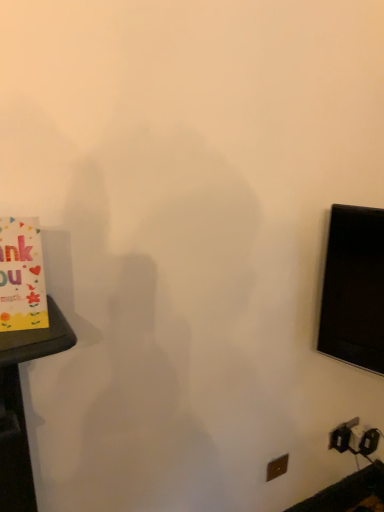
Question: From a real-world perspective, is brown plastic electric outlet at lower right positioned over yellow paper card at left based on gravity?

Choices:
 (A) yes
 (B) no

Answer: (B)

Question: Is brown plastic electric outlet at lower right looking in the opposite direction of yellow paper card at left?

Choices:
 (A) yes
 (B) no

Answer: (B)

Question: Does brown plastic electric outlet at lower right have a greater width compared to yellow paper card at left?

Choices:
 (A) yes
 (B) no

Answer: (B)

Question: Is brown plastic electric outlet at lower right positioned far away from yellow paper card at left?

Choices:
 (A) no
 (B) yes

Answer: (B)

Question: Does brown plastic electric outlet at lower right have a lesser width compared to yellow paper card at left?

Choices:
 (A) no
 (B) yes

Answer: (B)

Question: Can you confirm if brown plastic electric outlet at lower right is taller than yellow paper card at left?

Choices:
 (A) no
 (B) yes

Answer: (A)

Question: From the image's perspective, would you say yellow paper card at left is shown under brown plastic electric outlet at lower right?

Choices:
 (A) no
 (B) yes

Answer: (A)

Question: Is the surface of yellow paper card at left in direct contact with brown plastic electric outlet at lower right?

Choices:
 (A) yes
 (B) no

Answer: (B)

Question: Considering the relative sizes of yellow paper card at left and brown plastic electric outlet at lower right in the image provided, is yellow paper card at left taller than brown plastic electric outlet at lower right?

Choices:
 (A) no
 (B) yes

Answer: (B)

Question: Can you confirm if yellow paper card at left is thinner than brown plastic electric outlet at lower right?

Choices:
 (A) no
 (B) yes

Answer: (A)

Question: Is brown plastic electric outlet at lower right surrounded by yellow paper card at left?

Choices:
 (A) yes
 (B) no

Answer: (B)

Question: Is yellow paper card at left to the right of brown plastic electric outlet at lower right from the viewer's perspective?

Choices:
 (A) no
 (B) yes

Answer: (A)

Question: Looking at the image, does brown plastic electric outlet at lower right seem bigger or smaller compared to yellow paper card at left?

Choices:
 (A) small
 (B) big

Answer: (A)